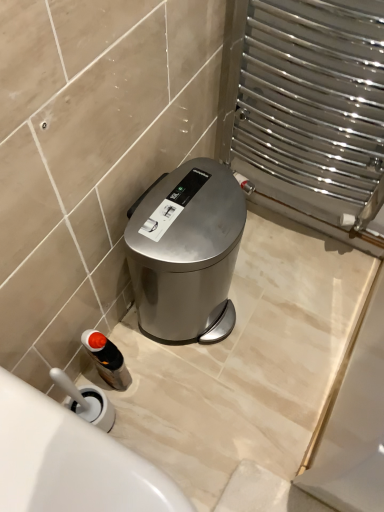
Question: Is translucent plastic bottle at lower left taller than white glossy bath at lower left?

Choices:
 (A) yes
 (B) no

Answer: (B)

Question: Is the depth of translucent plastic bottle at lower left greater than that of white glossy bath at lower left?

Choices:
 (A) no
 (B) yes

Answer: (B)

Question: Could you tell me if translucent plastic bottle at lower left is facing white glossy bath at lower left?

Choices:
 (A) yes
 (B) no

Answer: (B)

Question: Is translucent plastic bottle at lower left positioned before white glossy bath at lower left?

Choices:
 (A) yes
 (B) no

Answer: (B)

Question: Can you confirm if translucent plastic bottle at lower left is thinner than white glossy bath at lower left?

Choices:
 (A) yes
 (B) no

Answer: (A)

Question: Is translucent plastic bottle at lower left facing away from white glossy bath at lower left?

Choices:
 (A) yes
 (B) no

Answer: (B)

Question: Can you confirm if satin silver trash can at center is wider than translucent plastic bottle at lower left?

Choices:
 (A) no
 (B) yes

Answer: (B)

Question: Is satin silver trash can at center positioned behind translucent plastic bottle at lower left?

Choices:
 (A) yes
 (B) no

Answer: (B)

Question: Is satin silver trash can at center looking in the opposite direction of translucent plastic bottle at lower left?

Choices:
 (A) no
 (B) yes

Answer: (A)

Question: From the image's perspective, would you say satin silver trash can at center is shown under translucent plastic bottle at lower left?

Choices:
 (A) yes
 (B) no

Answer: (B)

Question: Is satin silver trash can at center to the left of translucent plastic bottle at lower left from the viewer's perspective?

Choices:
 (A) no
 (B) yes

Answer: (A)

Question: From the image's perspective, does satin silver trash can at center appear higher than translucent plastic bottle at lower left?

Choices:
 (A) no
 (B) yes

Answer: (B)

Question: Is white glossy bath at lower left not within satin silver trash can at center?

Choices:
 (A) no
 (B) yes

Answer: (B)